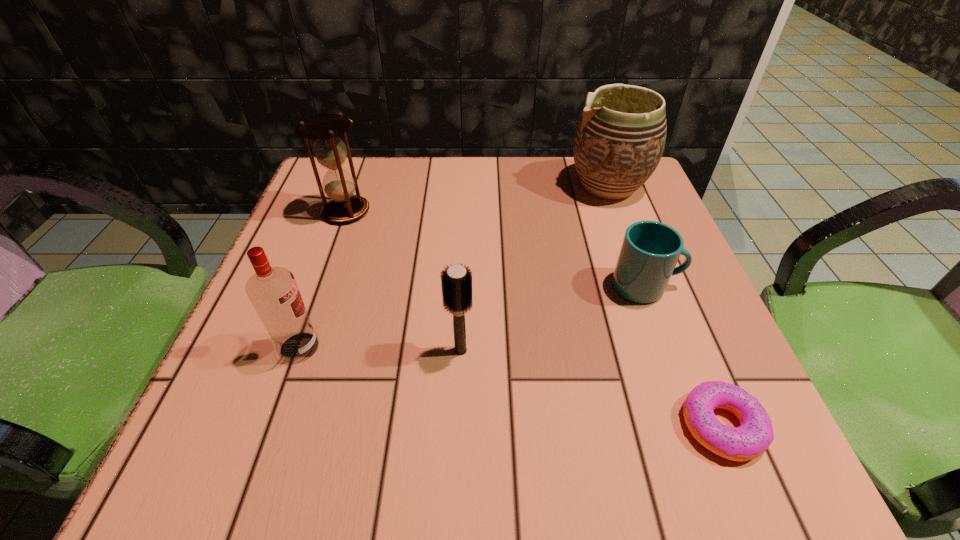
Identify the location of free region located 0.240m on the front of the hourglass. The image size is (960, 540). (309, 315).

At what (x,y) coordinates should I click in order to perform the action: click on free space located on the front label of the vodka. Please return your answer as a coordinate pair (x, y). This screenshot has height=540, width=960. Looking at the image, I should click on (408, 347).

I want to click on vacant point located 0.330m on the left of the hairbrush, so click(237, 350).

The height and width of the screenshot is (540, 960). I want to click on vacant area situated on the back of the nearest object, so click(x=640, y=227).

I want to click on pottery present at the far edge, so click(619, 140).

Where is `hourglass that is at the far edge`? hourglass that is at the far edge is located at coordinates pos(330,151).

Image resolution: width=960 pixels, height=540 pixels. I want to click on object present at the near edge, so click(752, 438).

The width and height of the screenshot is (960, 540). What are the coordinates of `hourglass at the left edge` in the screenshot? It's located at [x=330, y=151].

Identify the location of vodka located at the left edge. The height and width of the screenshot is (540, 960). (273, 292).

At what (x,y) coordinates should I click in order to perform the action: click on pottery at the right edge. Please return your answer as a coordinate pair (x, y). This screenshot has height=540, width=960. Looking at the image, I should click on (619, 140).